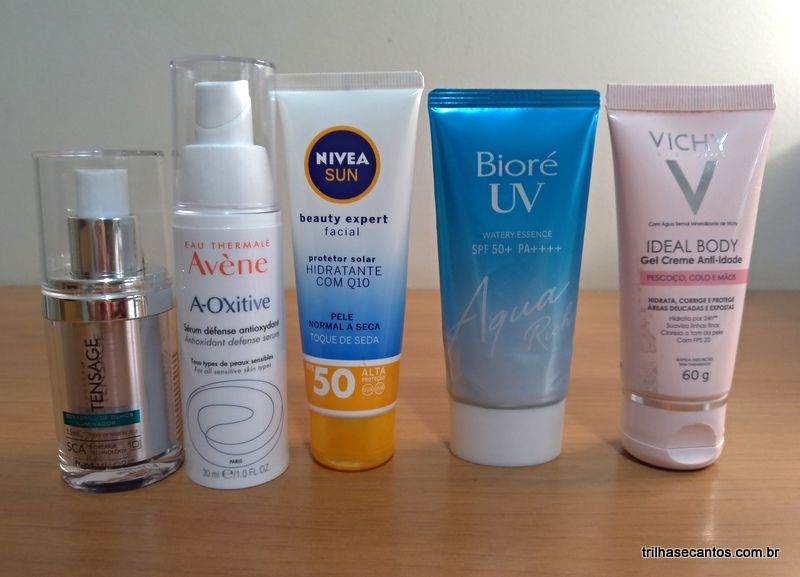
Identify the location of light source. This screenshot has width=800, height=577. (780, 23).